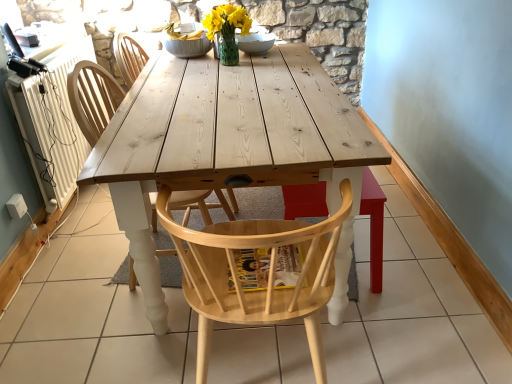
In order to click on free space on the front side of natural wood chair at center, the second chair when ordered from front to back in this screenshot , I will do `click(124, 334)`.